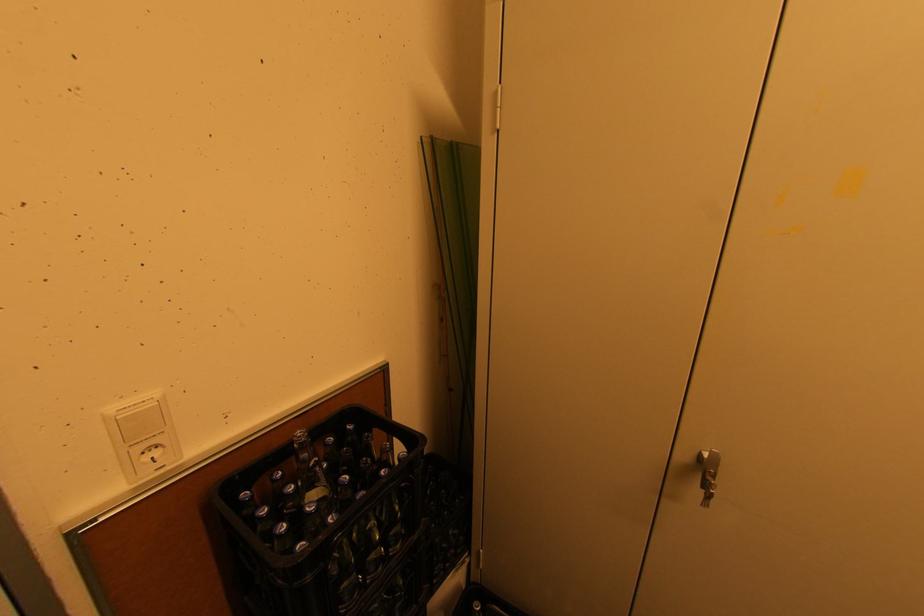
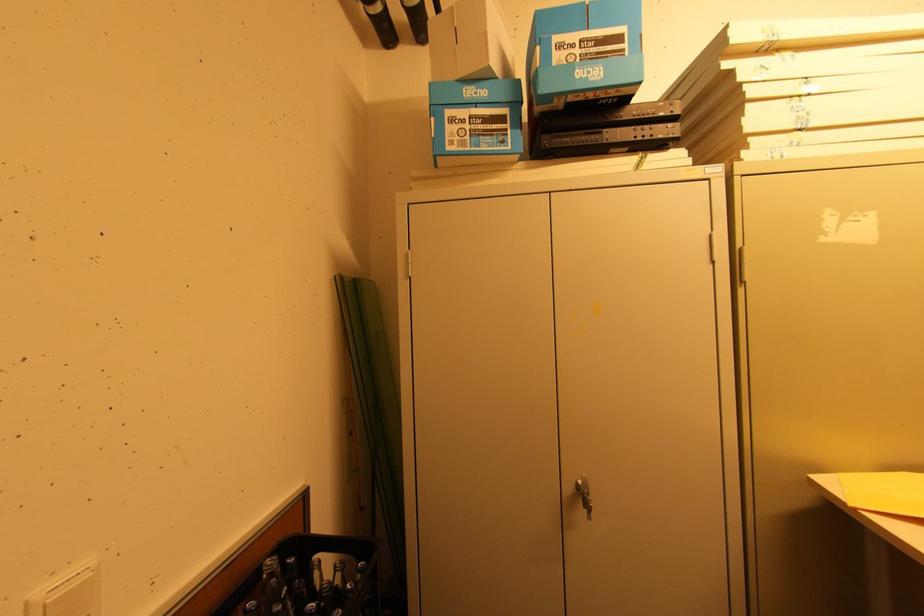
In the second image, find the point that corresponds to point (157, 394) in the first image.

(91, 562)